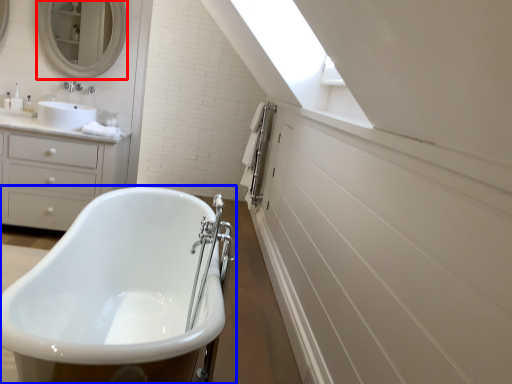
Question: Which point is closer to the camera, mirror (highlighted by a red box) or bathtub (highlighted by a blue box)?

Choices:
 (A) mirror
 (B) bathtub

Answer: (B)